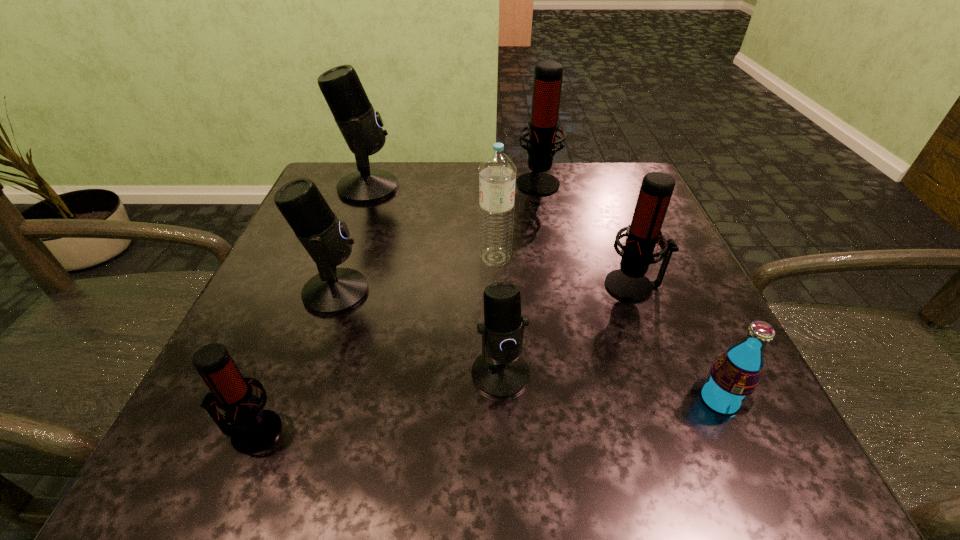
You are a GUI agent. You are given a task and a screenshot of the screen. Output one action in this format:
    pyautogui.click(x=<x>, y=<y>)
    Task: Click on the nearest microphone
    The width and height of the screenshot is (960, 540).
    Given the screenshot: What is the action you would take?
    pyautogui.click(x=252, y=429)

I want to click on soda, so click(733, 377).

Locate an element on the screen. The height and width of the screenshot is (540, 960). free region located 0.320m on the left of the second red microphone from left to right is located at coordinates (383, 182).

Locate an element on the screen. Image resolution: width=960 pixels, height=540 pixels. blank space located 0.060m on the stand of the farthest black microphone is located at coordinates (423, 188).

At what (x,y) coordinates should I click in order to perform the action: click on vacant space located on the front of the third farthest object. Please return your answer as a coordinate pair (x, y). This screenshot has height=540, width=960. Looking at the image, I should click on (500, 387).

Where is `vacant space located on the stand of the second smallest black microphone`? vacant space located on the stand of the second smallest black microphone is located at coordinates (550, 292).

Locate an element on the screen. vacant region located 0.070m on the front of the rightmost microphone is located at coordinates (651, 333).

You are a GUI agent. You are given a task and a screenshot of the screen. Output one action in this format:
    pyautogui.click(x=<x>, y=<y>)
    Task: Click on the vacant space positioned on the stand of the rightmost black microphone
    
    Given the screenshot: What is the action you would take?
    pyautogui.click(x=503, y=446)

Identify the location of vacant space located on the right of the smallest red microphone. Image resolution: width=960 pixels, height=540 pixels. (532, 431).

Locate an element on the screen. The width and height of the screenshot is (960, 540). free region located 0.320m on the left of the soda is located at coordinates (464, 400).